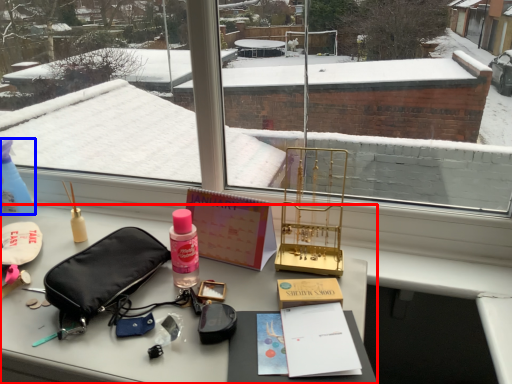
Question: Which object appears farthest to the camera in this image, desk (highlighted by a red box) or bottle (highlighted by a blue box)?

Choices:
 (A) desk
 (B) bottle

Answer: (B)